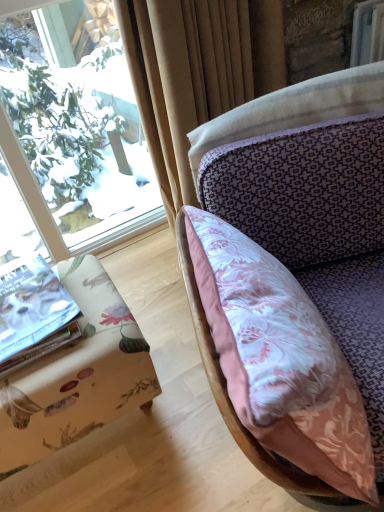
Question: Would you say pink floral fabric pillow at center is to the left or to the right of silky beige curtain at upper center in the picture?

Choices:
 (A) right
 (B) left

Answer: (A)

Question: Considering the positions of pink floral fabric pillow at center and silky beige curtain at upper center in the image, is pink floral fabric pillow at center wider or thinner than silky beige curtain at upper center?

Choices:
 (A) thin
 (B) wide

Answer: (B)

Question: Considering the real-world distances, which object is closest to the silky beige curtain at upper center?

Choices:
 (A) pink floral fabric pillow at center
 (B) floral fabric ottoman at lower left
 (C) white paper book at lower left

Answer: (A)

Question: Considering the real-world distances, which object is farthest from the white paper book at lower left?

Choices:
 (A) floral fabric ottoman at lower left
 (B) pink floral fabric pillow at center
 (C) silky beige curtain at upper center

Answer: (C)